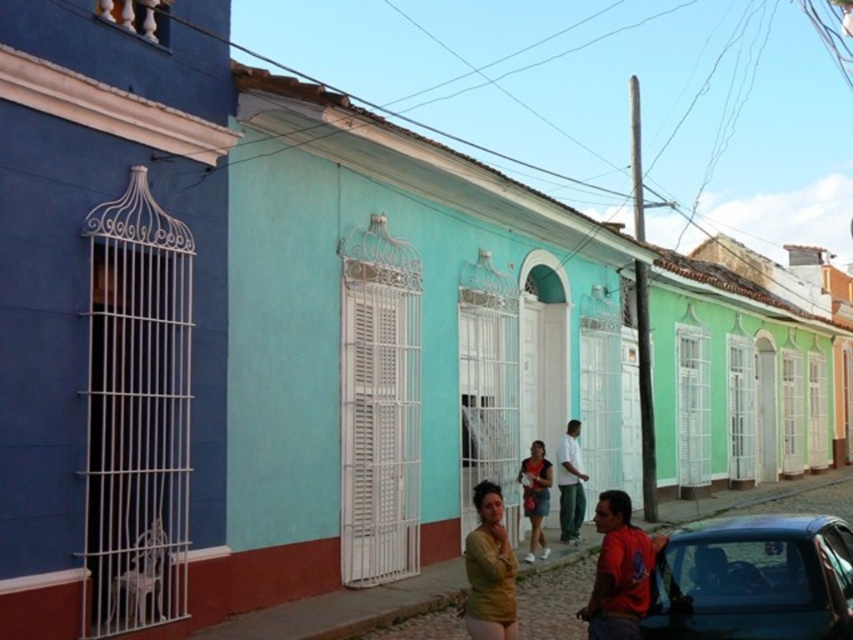
Question: From the image, what is the correct spatial relationship of red cotton shirt at lower right in relation to matte yellow shirt at center?

Choices:
 (A) below
 (B) above

Answer: (A)

Question: Based on their relative distances, which object is nearer to the shiny blue car at lower right?

Choices:
 (A) matte black shirt at center
 (B) red cotton shirt at lower right
 (C) matte yellow shirt at center

Answer: (B)

Question: Among these points, which one is nearest to the camera?

Choices:
 (A) (525, 554)
 (B) (572, 486)

Answer: (A)

Question: Can you confirm if matte yellow shirt at center is smaller than white cotton shirt at center?

Choices:
 (A) no
 (B) yes

Answer: (B)

Question: Which object is farther from the camera taking this photo?

Choices:
 (A) red cotton shirt at lower right
 (B) white cotton shirt at center

Answer: (B)

Question: From the image, what is the correct spatial relationship of white cotton shirt at center in relation to matte black shirt at center?

Choices:
 (A) right
 (B) left

Answer: (A)